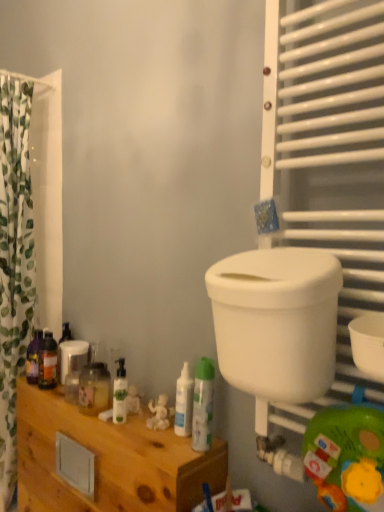
Describe the element at coordinates (109, 460) in the screenshot. I see `wooden cabinet at lower left` at that location.

In order to face translucent plastic bottle at left, which is the fifth toiletry from right to left, should I rotate leftwards or rightwards?

You should look left and rotate roughly 20.561 degrees.

The image size is (384, 512). Find the location of `white glossy pump bottle at center, arranged as the third toiletry when viewed from the back`. white glossy pump bottle at center, arranged as the third toiletry when viewed from the back is located at coordinates (120, 394).

How much space does white glossy spray can at center, arranged as the 5th toiletry when viewed from the back, occupy vertically?

The height of white glossy spray can at center, arranged as the 5th toiletry when viewed from the back, is 23.39 centimeters.

What is the approximate height of white glossy bottle at center, the 2th toiletry viewed from the right?

white glossy bottle at center, the 2th toiletry viewed from the right, is 7.91 inches tall.

Image resolution: width=384 pixels, height=512 pixels. What do you see at coordinates (14, 263) in the screenshot?
I see `green leaf-patterned fabric at left` at bounding box center [14, 263].

This screenshot has height=512, width=384. Identify the location of white plastic toilet bowl at right. (276, 321).

How different are the orientations of green leaf-patterned fabric at left and translucent plastic bottles at lower left, the second toiletry in the back-to-front sequence, in degrees?

76.1 degrees separate the facing orientations of green leaf-patterned fabric at left and translucent plastic bottles at lower left, the second toiletry in the back-to-front sequence.

Based on their sizes in the image, would you say green leaf-patterned fabric at left is bigger or smaller than translucent plastic bottles at lower left, which is counted as the 2th toiletry, starting from the left?

In the image, green leaf-patterned fabric at left appears to be larger than translucent plastic bottles at lower left, which is counted as the 2th toiletry, starting from the left.

Where is `curtain behind the translucent plastic bottles at lower left, the second toiletry in the back-to-front sequence`? This screenshot has width=384, height=512. curtain behind the translucent plastic bottles at lower left, the second toiletry in the back-to-front sequence is located at coordinates (14, 263).

Is white glossy bottle at center, placed as the 4th toiletry when sorted from back to front, shorter than translucent plastic bottle at left, the first toiletry from the left?

Yes, white glossy bottle at center, placed as the 4th toiletry when sorted from back to front, is shorter than translucent plastic bottle at left, the first toiletry from the left.

From a real-world perspective, is white glossy bottle at center, marked as the fourth toiletry in a left-to-right arrangement, under translucent plastic bottle at left, the first toiletry from the left?

No, from a real-world perspective, white glossy bottle at center, marked as the fourth toiletry in a left-to-right arrangement, is not beneath translucent plastic bottle at left, the first toiletry from the left.

Considering the relative sizes of white glossy bottle at center, acting as the 2th toiletry starting from the front, and translucent plastic bottle at left, which appears as the 1th toiletry when viewed from the back, in the image provided, is white glossy bottle at center, acting as the 2th toiletry starting from the front, smaller than translucent plastic bottle at left, which appears as the 1th toiletry when viewed from the back,?

Correct, white glossy bottle at center, acting as the 2th toiletry starting from the front, occupies less space than translucent plastic bottle at left, which appears as the 1th toiletry when viewed from the back.

Consider the image. How different are the orientations of white glossy pump bottle at center, arranged as the third toiletry when viewed from the back, and white glossy bottle at center, placed as the 4th toiletry when sorted from back to front, in degrees?

1.14 degrees.

Which of these two, white glossy pump bottle at center, the 3th toiletry when ordered from left to right, or white glossy bottle at center, the 2th toiletry viewed from the right, stands taller?

Standing taller between the two is white glossy bottle at center, the 2th toiletry viewed from the right.

Looking at this image, would you say white glossy pump bottle at center, which appears as the third toiletry when viewed from the front, is outside white glossy bottle at center, acting as the 2th toiletry starting from the front?

Yes, white glossy pump bottle at center, which appears as the third toiletry when viewed from the front, is not within white glossy bottle at center, acting as the 2th toiletry starting from the front.

Looking at this image, who is taller, green leaf-patterned fabric at left or white glossy pump bottle at center, the 3th toiletry viewed from the right?

green leaf-patterned fabric at left is taller.

Which is behind, green leaf-patterned fabric at left or white glossy pump bottle at center, arranged as the third toiletry when viewed from the back?

green leaf-patterned fabric at left.

In the scene shown: Which of these two, green leaf-patterned fabric at left or white glossy pump bottle at center, the 3th toiletry viewed from the right, is wider?

green leaf-patterned fabric at left is wider.

At what (x,y) coordinates should I click in order to perform the action: click on the 5th toiletry above when counting from the wooden cabinet at lower left (from the image's perspective). Please return your answer as a coordinate pair (x, y). This screenshot has width=384, height=512. Looking at the image, I should click on (47, 362).

Is wooden cabinet at lower left in contact with translucent plastic bottles at lower left, the fourth toiletry from the right?

No, wooden cabinet at lower left is not touching translucent plastic bottles at lower left, the fourth toiletry from the right.

Considering the sizes of objects wooden cabinet at lower left and translucent plastic bottles at lower left, the fourth toiletry in the front-to-back sequence, in the image provided, who is shorter, wooden cabinet at lower left or translucent plastic bottles at lower left, the fourth toiletry in the front-to-back sequence,?

translucent plastic bottles at lower left, the fourth toiletry in the front-to-back sequence.

How different are the orientations of wooden cabinet at lower left and translucent plastic bottles at lower left, the second toiletry in the back-to-front sequence, in degrees?

wooden cabinet at lower left and translucent plastic bottles at lower left, the second toiletry in the back-to-front sequence, are facing 5.43 degrees away from each other.

Considering the sizes of white glossy bottle at center, acting as the 2th toiletry starting from the front, and translucent plastic bottles at lower left, the fourth toiletry from the right, in the image, is white glossy bottle at center, acting as the 2th toiletry starting from the front, wider or thinner than translucent plastic bottles at lower left, the fourth toiletry from the right,?

white glossy bottle at center, acting as the 2th toiletry starting from the front, is thinner than translucent plastic bottles at lower left, the fourth toiletry from the right.

Is white glossy bottle at center, marked as the fourth toiletry in a left-to-right arrangement, in contact with translucent plastic bottles at lower left, the fourth toiletry in the front-to-back sequence?

They are not placed beside each other.

In terms of size, does white glossy bottle at center, the 2th toiletry viewed from the right, appear bigger or smaller than translucent plastic bottles at lower left, the fourth toiletry from the right?

Considering their sizes, white glossy bottle at center, the 2th toiletry viewed from the right, takes up less space than translucent plastic bottles at lower left, the fourth toiletry from the right.

From a real-world perspective, which is physically above, white glossy spray can at center, the 1th toiletry from the right, or white glossy bottle at center, marked as the fourth toiletry in a left-to-right arrangement?

white glossy spray can at center, the 1th toiletry from the right, from a real-world perspective.

Visually, is white glossy spray can at center, the 1th toiletry from the right, positioned to the left or to the right of white glossy bottle at center, placed as the 4th toiletry when sorted from back to front?

Clearly, white glossy spray can at center, the 1th toiletry from the right, is on the right of white glossy bottle at center, placed as the 4th toiletry when sorted from back to front, in the image.

Which object is wider, white glossy spray can at center, the 1th toiletry when ordered from front to back, or white glossy bottle at center, placed as the 4th toiletry when sorted from back to front?

Wider between the two is white glossy spray can at center, the 1th toiletry when ordered from front to back.

How many degrees apart are the facing directions of white glossy spray can at center, placed as the 5th toiletry when sorted from left to right, and white glossy bottle at center, marked as the fourth toiletry in a left-to-right arrangement?

There is a 3.04-degree angle between the facing directions of white glossy spray can at center, placed as the 5th toiletry when sorted from left to right, and white glossy bottle at center, marked as the fourth toiletry in a left-to-right arrangement.

Image resolution: width=384 pixels, height=512 pixels. There is a translucent plastic bottles at lower left, the fourth toiletry in the front-to-back sequence. Find the location of `curtain above it (from a real-world perspective)`. curtain above it (from a real-world perspective) is located at coordinates (14, 263).

At what (x,y) coordinates should I click in order to perform the action: click on the 3rd toiletry positioned above the white glossy bottle at center, marked as the fourth toiletry in a left-to-right arrangement (from the image's perspective). Please return your answer as a coordinate pair (x, y). This screenshot has height=512, width=384. Looking at the image, I should click on (33, 357).

Looking at this image, from the image, which object appears to be nearer to green leaf-patterned fabric at left, white glossy spray can at center, the 1th toiletry when ordered from front to back, or translucent plastic bottles at lower left, the second toiletry in the back-to-front sequence?

Based on the image, translucent plastic bottles at lower left, the second toiletry in the back-to-front sequence, appears to be nearer to green leaf-patterned fabric at left.

Based on their spatial positions, is wooden cabinet at lower left or white glossy pump bottle at center, which appears as the third toiletry when viewed from the front, further from white glossy spray can at center, arranged as the 5th toiletry when viewed from the back?

wooden cabinet at lower left lies further to white glossy spray can at center, arranged as the 5th toiletry when viewed from the back, than the other object.

When comparing their distances from white glossy pump bottle at center, which appears as the third toiletry when viewed from the front, does translucent plastic bottles at lower left, the fourth toiletry from the right, or white glossy bottle at center, placed as the 4th toiletry when sorted from back to front, seem further?

Among the two, translucent plastic bottles at lower left, the fourth toiletry from the right, is located further to white glossy pump bottle at center, which appears as the third toiletry when viewed from the front.

Which object lies nearer to the anchor point white glossy bottle at center, marked as the fourth toiletry in a left-to-right arrangement, white glossy spray can at center, placed as the 5th toiletry when sorted from left to right, or translucent plastic bottle at left, which is the fifth toiletry from front to back?

white glossy spray can at center, placed as the 5th toiletry when sorted from left to right.

From the image, which object appears to be nearer to translucent plastic bottles at lower left, the second toiletry in the back-to-front sequence, white plastic toilet bowl at right or white glossy bottle at center, marked as the fourth toiletry in a left-to-right arrangement?

white glossy bottle at center, marked as the fourth toiletry in a left-to-right arrangement, lies closer to translucent plastic bottles at lower left, the second toiletry in the back-to-front sequence, than the other object.

Estimate the real-world distances between objects in this image. Which object is further from translucent plastic bottles at lower left, the fourth toiletry in the front-to-back sequence, translucent plastic bottle at left, the first toiletry from the left, or wooden cabinet at lower left?

wooden cabinet at lower left is further to translucent plastic bottles at lower left, the fourth toiletry in the front-to-back sequence.

Based on their spatial positions, is white glossy bottle at center, placed as the 4th toiletry when sorted from back to front, or translucent plastic bottle at left, which is the fifth toiletry from front to back, closer to white glossy spray can at center, placed as the 5th toiletry when sorted from left to right?

white glossy bottle at center, placed as the 4th toiletry when sorted from back to front, lies closer to white glossy spray can at center, placed as the 5th toiletry when sorted from left to right, than the other object.

Based on their spatial positions, is green leaf-patterned fabric at left or translucent plastic bottles at lower left, which is counted as the 2th toiletry, starting from the left, closer to white plastic toilet bowl at right?

translucent plastic bottles at lower left, which is counted as the 2th toiletry, starting from the left, is positioned closer to the anchor white plastic toilet bowl at right.

Locate an element on the screen. This screenshot has width=384, height=512. furniture located between translucent plastic bottle at left, the first toiletry from the left, and white glossy bottle at center, marked as the fourth toiletry in a left-to-right arrangement, in the left-right direction is located at coordinates (109, 460).

This screenshot has width=384, height=512. What are the coordinates of `furniture between green leaf-patterned fabric at left and white glossy pump bottle at center, the 3th toiletry viewed from the right` in the screenshot? It's located at (109, 460).

Locate an element on the screen. Image resolution: width=384 pixels, height=512 pixels. furniture between translucent plastic bottles at lower left, which is counted as the 2th toiletry, starting from the left, and white glossy bottle at center, marked as the fourth toiletry in a left-to-right arrangement, in the horizontal direction is located at coordinates (109, 460).

Identify the location of toiletry between translucent plastic bottles at lower left, the second toiletry in the back-to-front sequence, and white glossy bottle at center, the 2th toiletry viewed from the right. (120, 394).